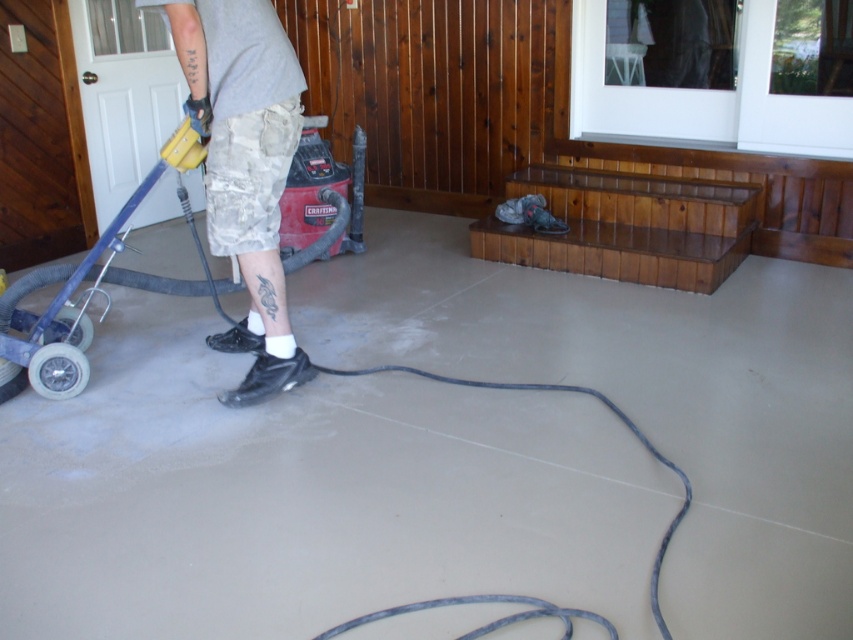
Looking at this image, you are a contractor assessing a work area. You see the smooth concrete floor at center and the camouflage shorts at left. Which object is closer to the viewer?

The smooth concrete floor at center is closer to the viewer than the camouflage shorts at left because the description states it is in front of the camouflage shorts at left.